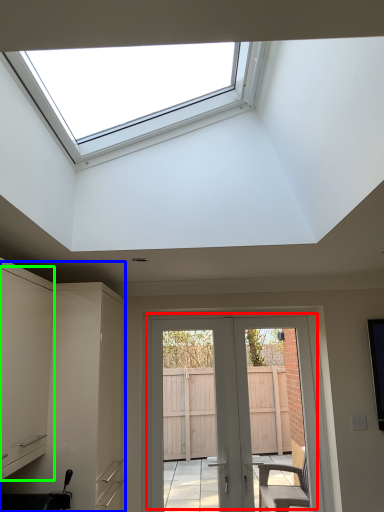
Question: Which is farther away from door (highlighted by a red box)? cabinetry (highlighted by a blue box) or cabinetry (highlighted by a green box)?

Choices:
 (A) cabinetry
 (B) cabinetry

Answer: (B)